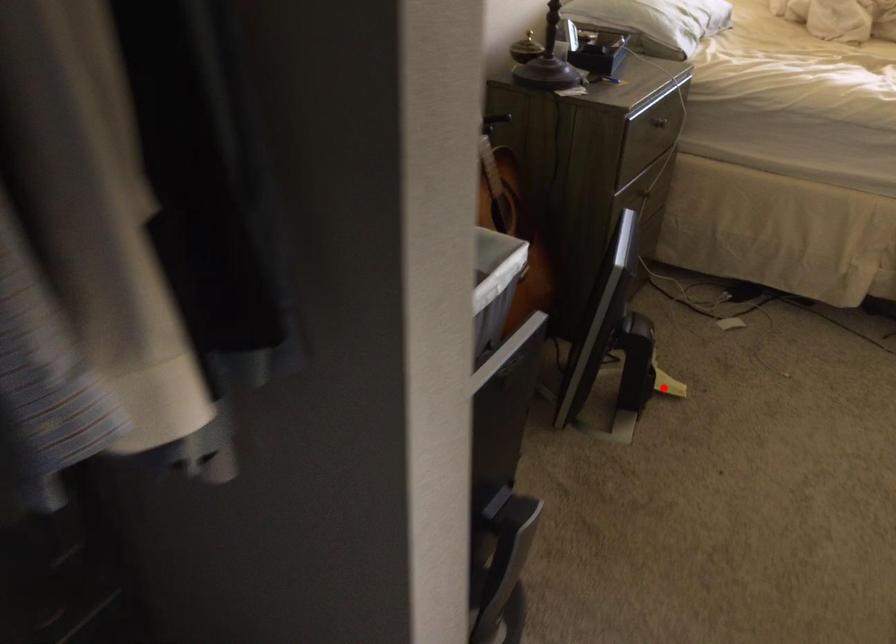
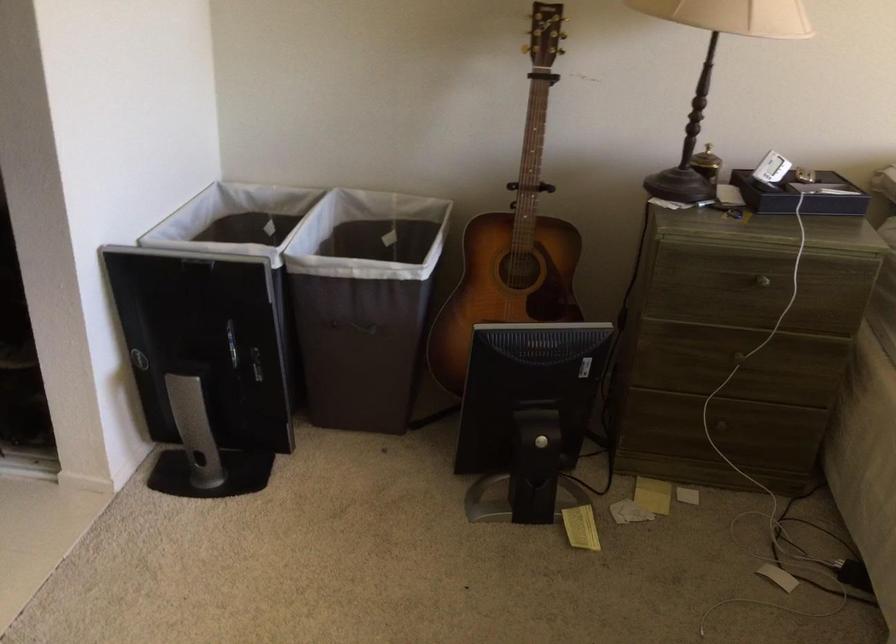
Question: I am providing you with two images of the same scene from different viewpoints. In image1, a red point is highlighted. Considering the same 3D point in image2, which of the following is correct?

Choices:
 (A) It is closer
 (B) It is farther

Answer: (A)